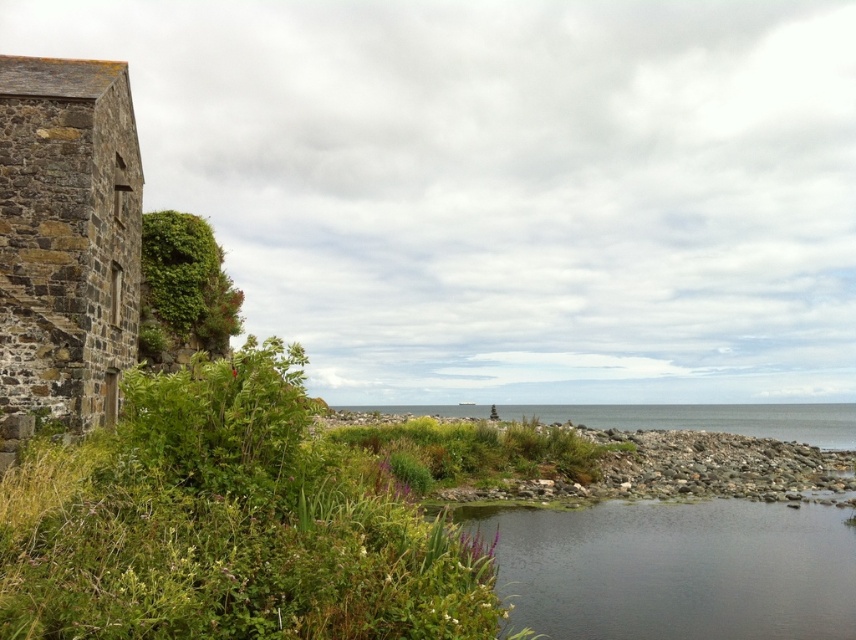
Question: Which point is closer to the camera taking this photo?

Choices:
 (A) (805, 433)
 (B) (645, 547)

Answer: (B)

Question: Is clear water at lower center below clear water at center?

Choices:
 (A) yes
 (B) no

Answer: (B)

Question: Can you confirm if clear water at lower center is positioned below clear water at center?

Choices:
 (A) yes
 (B) no

Answer: (B)

Question: Does clear water at lower center appear under clear water at center?

Choices:
 (A) no
 (B) yes

Answer: (A)